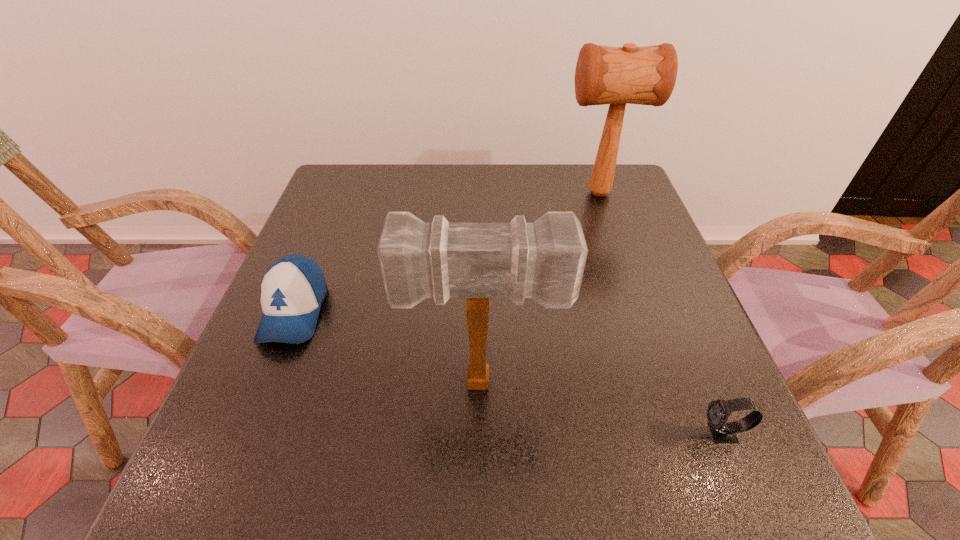
At what (x,y) coordinates should I click in order to perform the action: click on free spot between the right mallet and the watch. Please return your answer as a coordinate pair (x, y). The height and width of the screenshot is (540, 960). Looking at the image, I should click on (660, 314).

Find the location of a particular element. Image resolution: width=960 pixels, height=540 pixels. the closest object to the farther mallet is located at coordinates (544, 260).

Identify which object is the third closest to the watch. Please provide its 2D coordinates. Your answer should be formatted as a tuple, i.e. [(x, y)], where the tuple contains the x and y coordinates of a point satisfying the conditions above.

[(292, 290)]

The width and height of the screenshot is (960, 540). Identify the location of vacant region that satisfies the following two spatial constraints: 1. on the strike surface of the farthest object; 2. on the front-facing side of the second farthest object. (639, 312).

Locate an element on the screen. Image resolution: width=960 pixels, height=540 pixels. free space that satisfies the following two spatial constraints: 1. on the strike surface of the right mallet; 2. on the front side of the left mallet is located at coordinates (664, 383).

Identify the location of free space in the image that satisfies the following two spatial constraints: 1. on the front-facing side of the third object from right to left; 2. on the right side of the leftmost object. Image resolution: width=960 pixels, height=540 pixels. (266, 383).